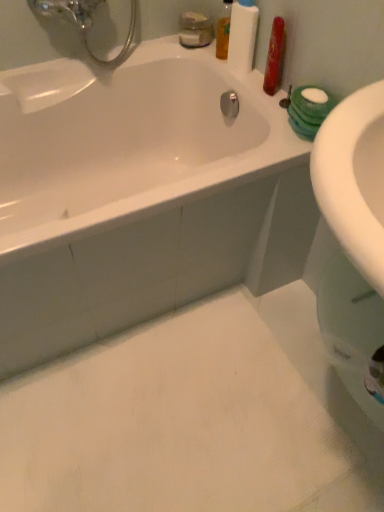
Question: Is translucent plastic mouthwash at upper center, placed as the second mouthwash when sorted from right to left, at the back of translucent orange liquid at upper right, the first mouthwash viewed from the right?

Choices:
 (A) no
 (B) yes

Answer: (A)

Question: Considering the relative sizes of translucent orange liquid at upper right, the 2th mouthwash from the left, and translucent plastic mouthwash at upper center, acting as the 1th mouthwash starting from the left, in the image provided, is translucent orange liquid at upper right, the 2th mouthwash from the left, thinner than translucent plastic mouthwash at upper center, acting as the 1th mouthwash starting from the left,?

Choices:
 (A) no
 (B) yes

Answer: (B)

Question: From a real-world perspective, is translucent orange liquid at upper right, the 2th mouthwash from the left, over translucent plastic mouthwash at upper center, acting as the 1th mouthwash starting from the left?

Choices:
 (A) no
 (B) yes

Answer: (B)

Question: Considering the relative positions of translucent orange liquid at upper right, the 2th mouthwash from the left, and translucent plastic mouthwash at upper center, placed as the second mouthwash when sorted from right to left, in the image provided, is translucent orange liquid at upper right, the 2th mouthwash from the left, to the right of translucent plastic mouthwash at upper center, placed as the second mouthwash when sorted from right to left, from the viewer's perspective?

Choices:
 (A) no
 (B) yes

Answer: (B)

Question: From the image's perspective, would you say translucent orange liquid at upper right, the first mouthwash viewed from the right, is positioned over translucent plastic mouthwash at upper center, placed as the second mouthwash when sorted from right to left?

Choices:
 (A) no
 (B) yes

Answer: (A)

Question: Is translucent orange liquid at upper right, the first mouthwash viewed from the right, situated inside white glossy bathtub at upper left or outside?

Choices:
 (A) inside
 (B) outside

Answer: (B)

Question: Is translucent orange liquid at upper right, the 2th mouthwash from the left, in front of or behind white glossy bathtub at upper left in the image?

Choices:
 (A) front
 (B) behind

Answer: (B)

Question: Is point (223, 18) positioned closer to the camera than point (228, 133)?

Choices:
 (A) closer
 (B) farther

Answer: (A)

Question: From the image's perspective, relative to white glossy bathtub at upper left, is translucent orange liquid at upper right, the 2th mouthwash from the left, above or below?

Choices:
 (A) above
 (B) below

Answer: (A)

Question: Which is correct: white matte bottle at upper right is inside translucent plastic mouthwash at upper center, placed as the second mouthwash when sorted from right to left, or outside of it?

Choices:
 (A) inside
 (B) outside

Answer: (B)

Question: In terms of size, does white matte bottle at upper right appear bigger or smaller than translucent plastic mouthwash at upper center, acting as the 1th mouthwash starting from the left?

Choices:
 (A) big
 (B) small

Answer: (B)

Question: Based on their positions, is white matte bottle at upper right located to the left or right of translucent plastic mouthwash at upper center, placed as the second mouthwash when sorted from right to left?

Choices:
 (A) left
 (B) right

Answer: (B)

Question: From a real-world perspective, relative to translucent plastic mouthwash at upper center, acting as the 1th mouthwash starting from the left, is white matte bottle at upper right vertically above or below?

Choices:
 (A) above
 (B) below

Answer: (A)

Question: Is point click(x=226, y=7) closer or farther from the camera than point click(x=240, y=53)?

Choices:
 (A) closer
 (B) farther

Answer: (B)

Question: In terms of width, does translucent orange liquid at upper right, the 2th mouthwash from the left, look wider or thinner when compared to white matte bottle at upper right?

Choices:
 (A) thin
 (B) wide

Answer: (A)